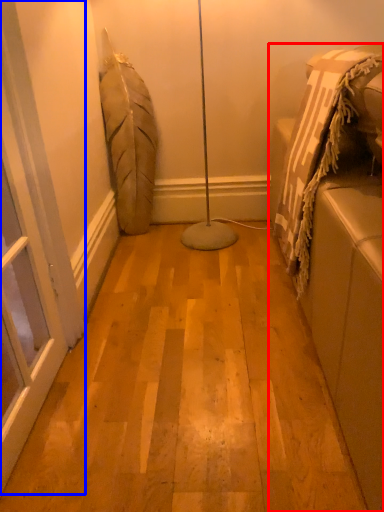
Question: Which object is further to the camera taking this photo, furniture (highlighted by a red box) or screen door (highlighted by a blue box)?

Choices:
 (A) furniture
 (B) screen door

Answer: (B)